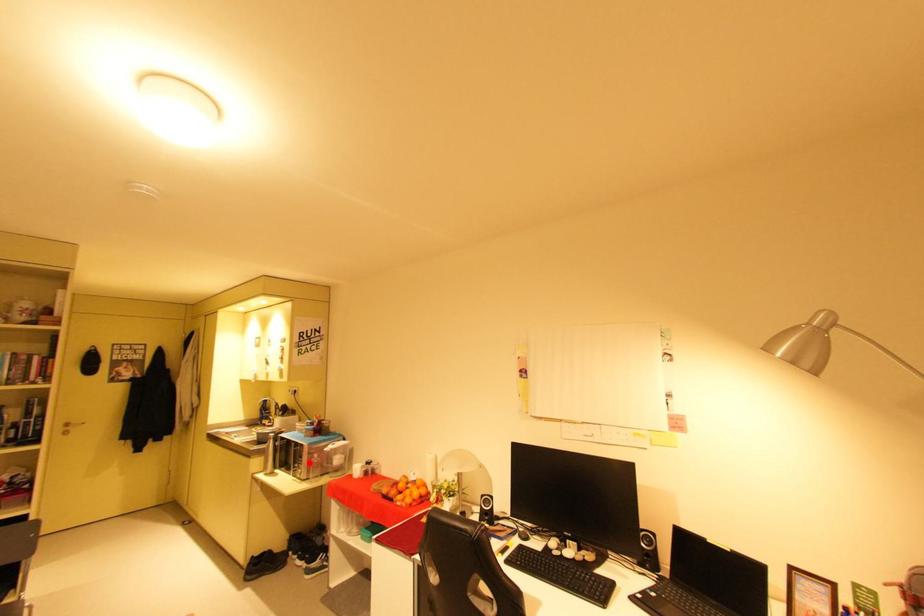
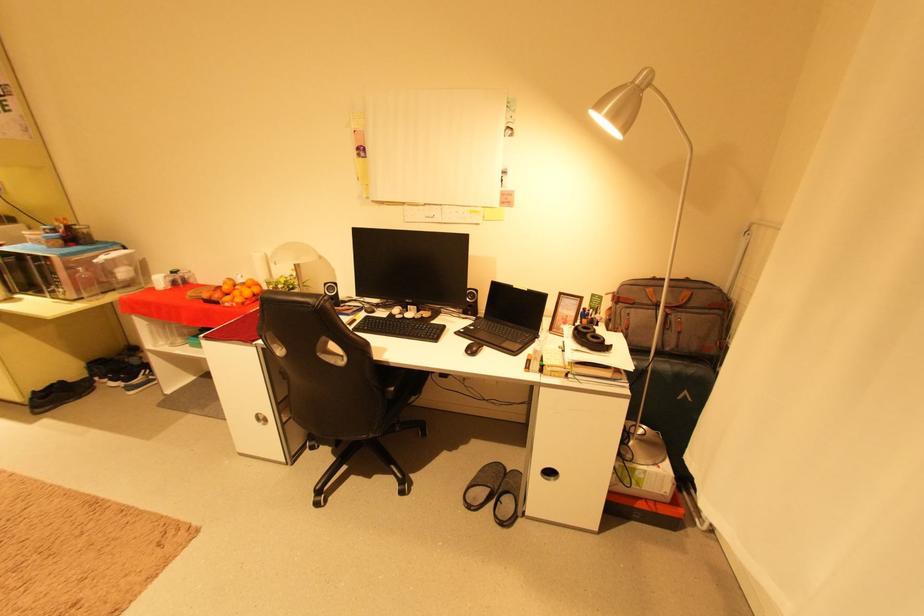
Where in the second image is the point corresponding to the highlighted location from the first image?

(66, 281)